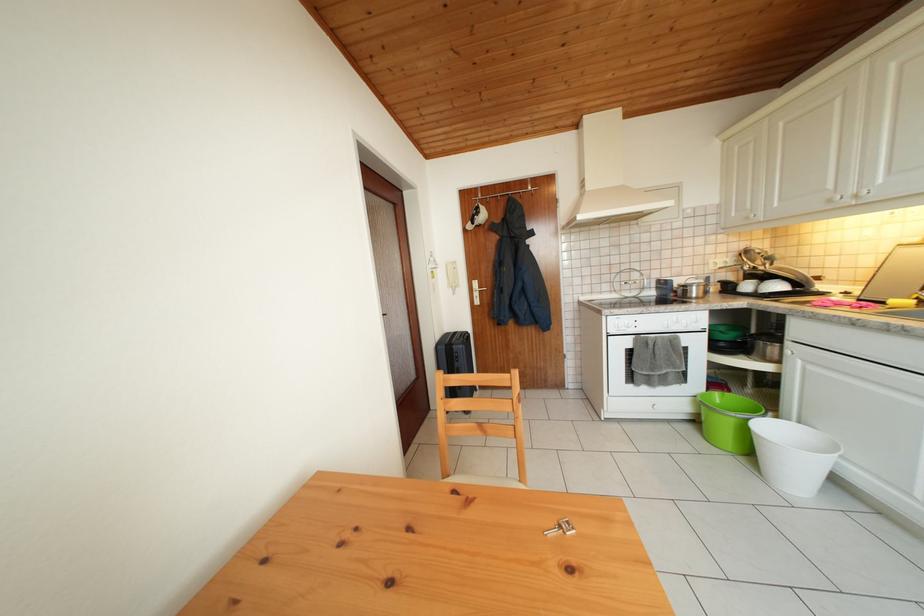
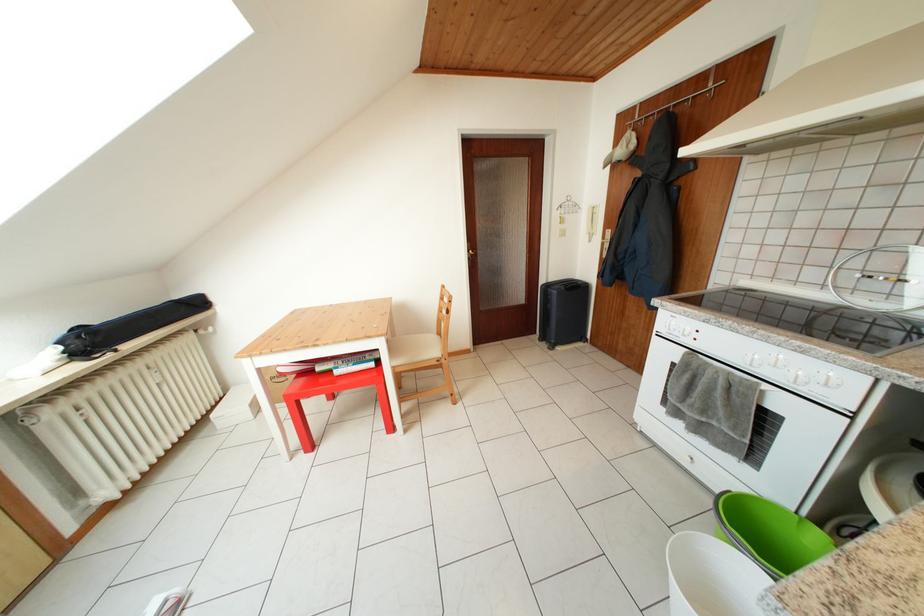
The point at (724, 399) is marked in the first image. Where is the corresponding point in the second image?

(828, 540)